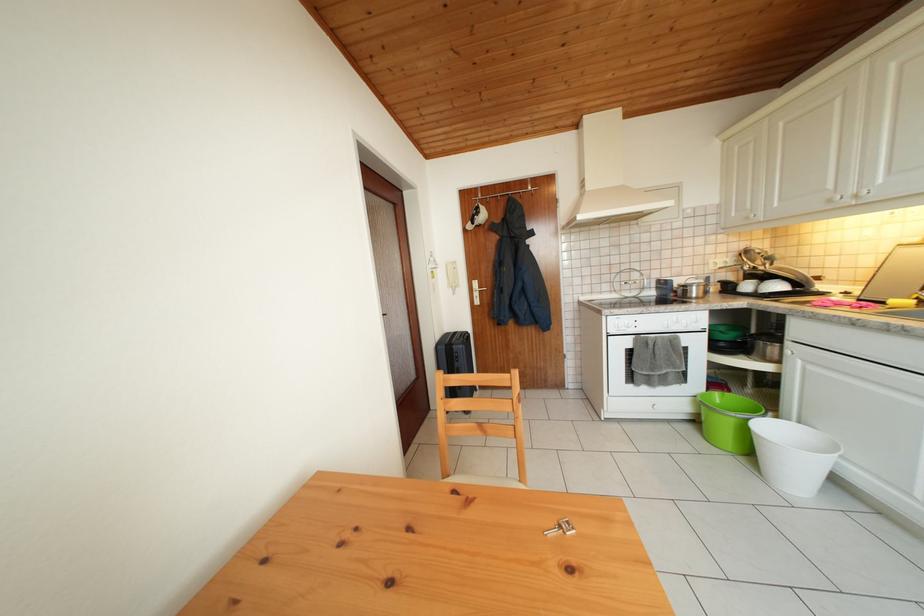
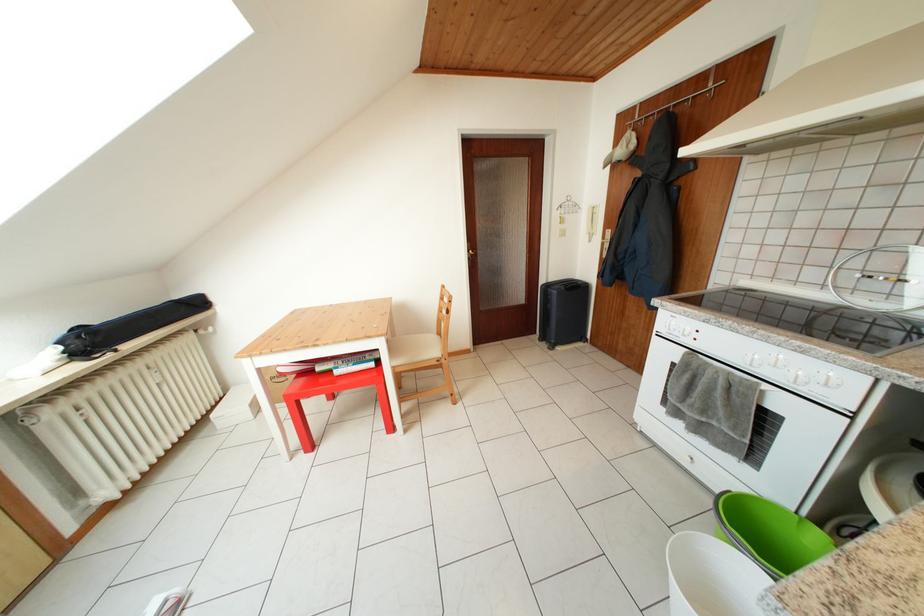
The point at (724, 399) is marked in the first image. Where is the corresponding point in the second image?

(828, 540)